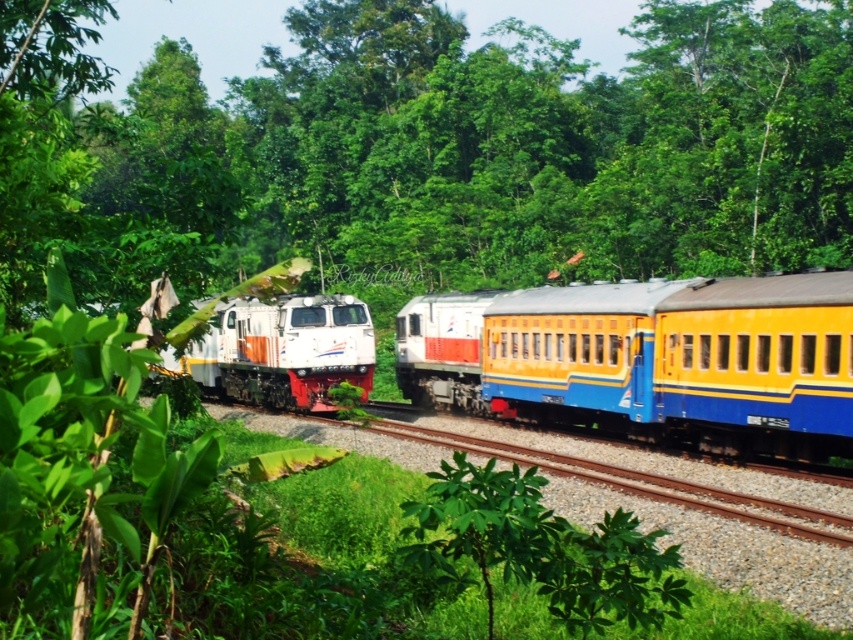
You are a safety inspector checking the distance between the yellow matte train car at center and the white glossy locomotive at center. What is the minimum safe distance required between them according to standard railway safety protocols?

The minimum safe distance between the yellow matte train car at center and the white glossy locomotive at center is 6.55 meters, which matches the current distance between them.

In the scene shown: You are a passenger on the yellow matte train car at center and want to look out the window to see the white glossy locomotive at center. Based on your current position, can you see it directly above you?

The yellow matte train car at center is below the white glossy locomotive at center, so yes, you can see the white glossy locomotive at center directly above you from your position on the yellow matte train car at center.

You are a passenger on the yellow matte train car at center and want to look out the window to see the green leafy tree at center. In which direction should you look?

You should look to your left because the green leafy tree at center is to the left of the yellow matte train car at center.